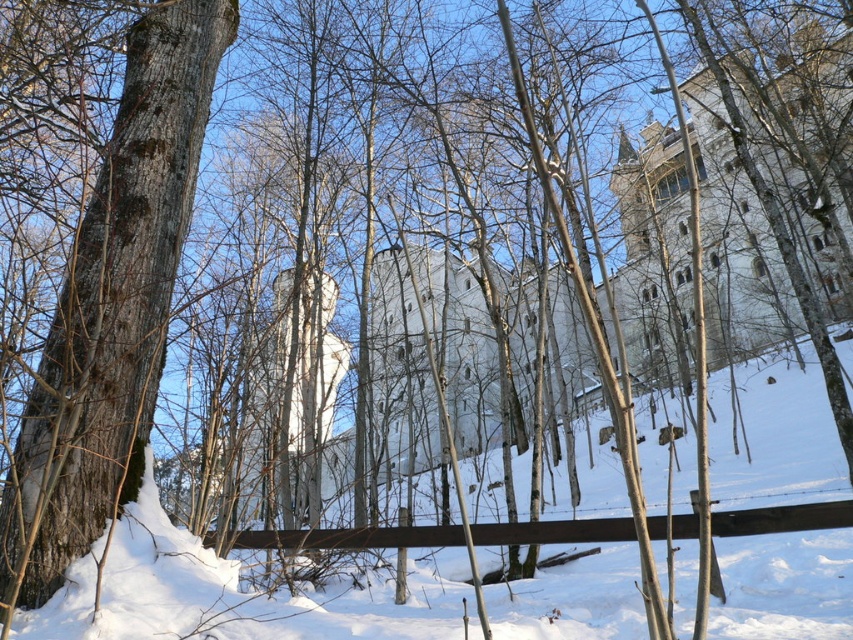
You are a delivery person trying to reach the front door of the large snow covered building that resembles a castle or fortress. You are currently standing at the wooden fence in the foreground. There is white powdery snow at center and a smooth bark tree at left. Which path between these two objects would allow you to reach the building faster?

The path between white powdery snow at center and smooth bark tree at left is 13.06 feet apart from each other. Since the distance is the same, either path would take the same amount of time to reach the building.

Consider the image. You are standing at the point closer to the wooden fence in the foreground. Which point are you at, point (474, 621) or point (157, 358)?

Point (474, 621) is in front of point (157, 358), so you are at point (474, 621).

You are standing at the point marked by the coordinates point (233, 593). Looking around, you see the white powdery snow at center. What is directly beneath your feet?

The point (233, 593) marks the white powdery snow at center, so what is directly beneath your feet is the white powdery snow at center.